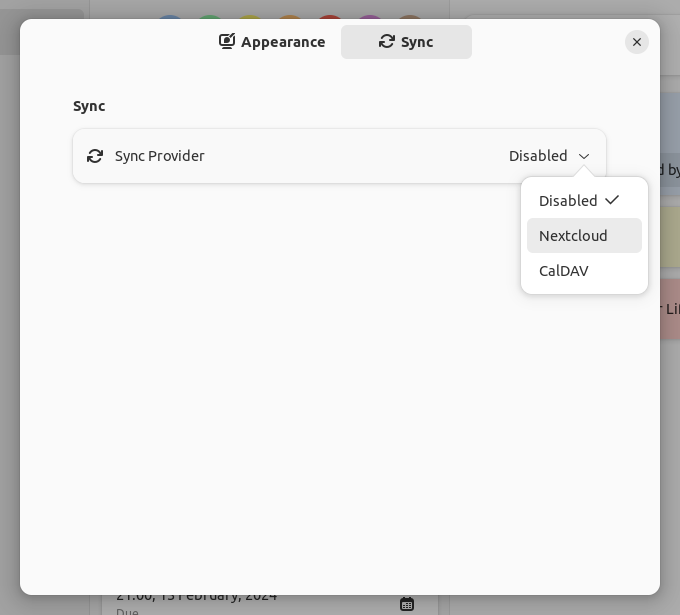
You are a GUI agent. You are given a task and a screenshot of the screen. Output one action in this format:
    pyautogui.click(x=<x>, y=<y>)
    Task: Click on the calendar
    The image size is (680, 615).
    Given the screenshot: What is the action you would take?
    click(413, 604)